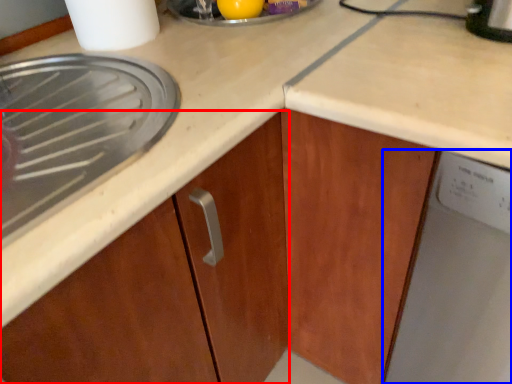
Question: Among these objects, which one is nearest to the camera, cabinetry (highlighted by a red box) or home appliance (highlighted by a blue box)?

Choices:
 (A) cabinetry
 (B) home appliance

Answer: (B)